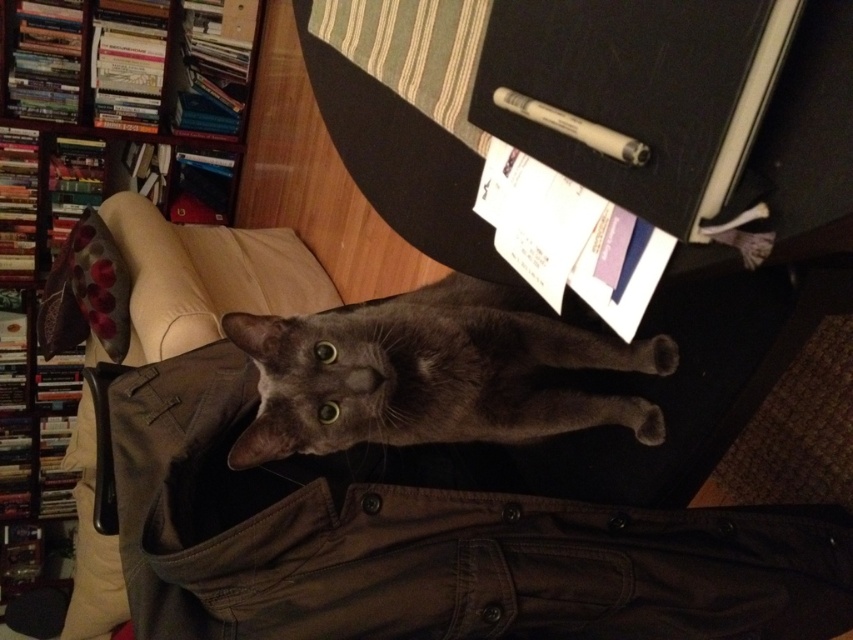
Question: Which point is closer to the camera?

Choices:
 (A) shiny gray cat at center
 (B) dark brown fabric pocket at center
 (C) wooden bookshelf at upper left

Answer: (B)

Question: Which of the following is the closest to the observer?

Choices:
 (A) (171, 65)
 (B) (714, 536)
 (C) (264, 385)

Answer: (C)

Question: Does dark brown fabric pocket at center lie behind wooden bookshelf at upper left?

Choices:
 (A) yes
 (B) no

Answer: (B)

Question: Is dark brown fabric pocket at center above wooden bookshelf at upper left?

Choices:
 (A) no
 (B) yes

Answer: (A)

Question: Which object appears farthest from the camera in this image?

Choices:
 (A) dark brown fabric pocket at center
 (B) wooden bookshelf at upper left
 (C) shiny gray cat at center

Answer: (B)

Question: Does dark brown fabric pocket at center have a lesser width compared to shiny gray cat at center?

Choices:
 (A) yes
 (B) no

Answer: (B)